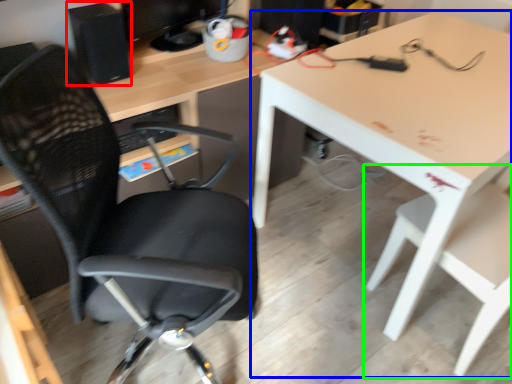
Question: Which object is positioned closest to computer tower (highlighted by a red box)? Select from table (highlighted by a blue box) and chair (highlighted by a green box).

Choices:
 (A) table
 (B) chair

Answer: (A)